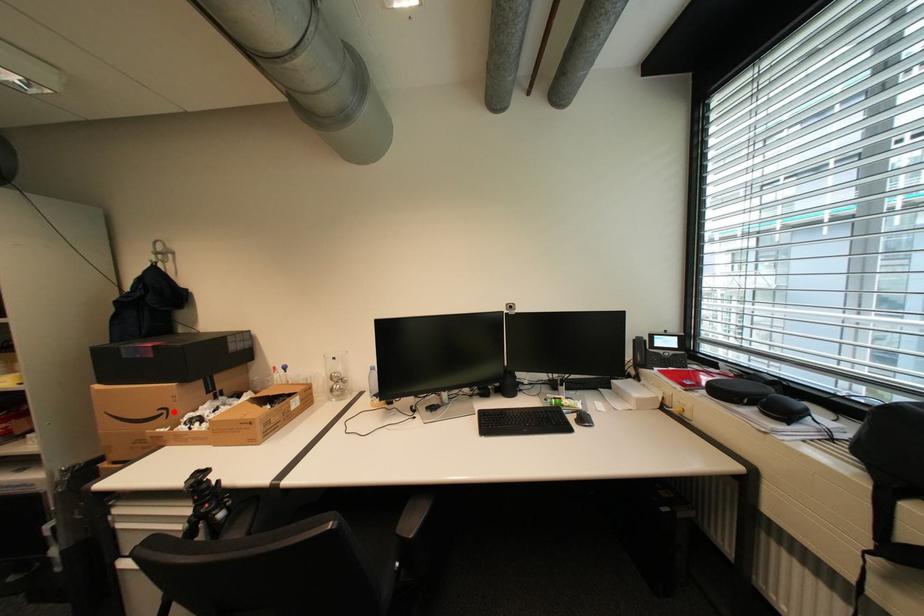
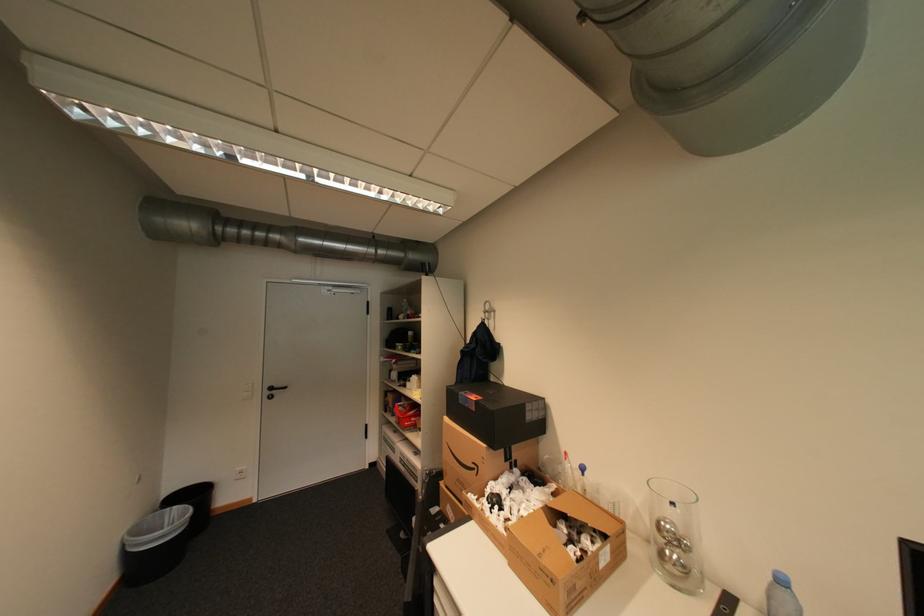
Question: A red point is marked in image1. In image2, is the corresponding 3D point closer to the camera or farther? Reply with the corresponding letter.

Choices:
 (A) The corresponding 3D point is closer.
 (B) The corresponding 3D point is farther.

Answer: (B)